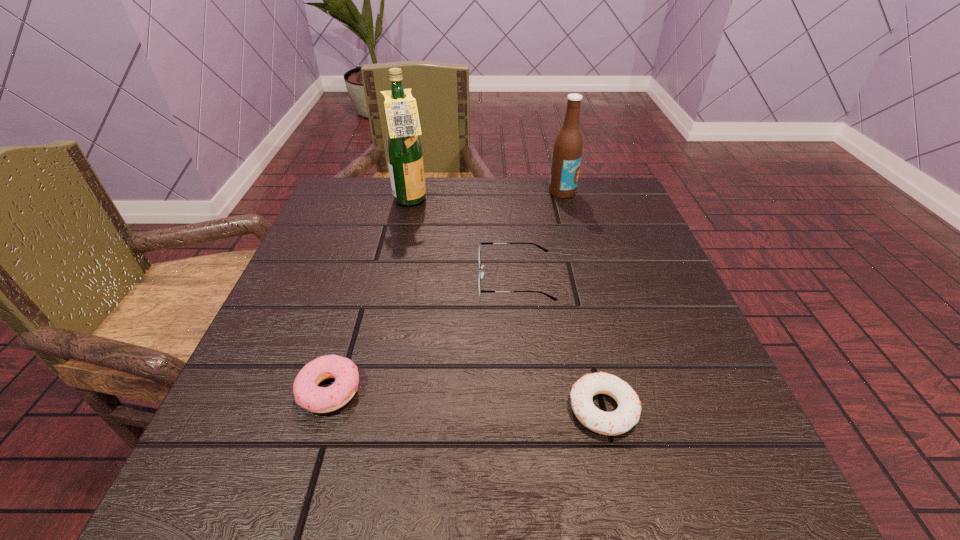
Identify the location of vacant area that lies between the spectacles and the left doughnut. (422, 335).

At what (x,y) coordinates should I click in order to perform the action: click on vacant space that's between the right doughnut and the left doughnut. Please return your answer as a coordinate pair (x, y). This screenshot has width=960, height=540. Looking at the image, I should click on click(x=467, y=400).

The width and height of the screenshot is (960, 540). In order to click on free space between the right doughnut and the liquor in this screenshot , I will do `click(507, 305)`.

You are a GUI agent. You are given a task and a screenshot of the screen. Output one action in this format:
    pyautogui.click(x=<x>, y=<y>)
    Task: Click on the free spot between the third tallest object and the left doughnut
    Image resolution: width=960 pixels, height=540 pixels.
    Given the screenshot: What is the action you would take?
    pyautogui.click(x=422, y=335)

You are a GUI agent. You are given a task and a screenshot of the screen. Output one action in this format:
    pyautogui.click(x=<x>, y=<y>)
    Task: Click on the free spot between the tallest object and the fourth shortest object
    The width and height of the screenshot is (960, 540).
    Given the screenshot: What is the action you would take?
    pyautogui.click(x=487, y=197)

Locate an element on the screen. This screenshot has width=960, height=540. free spot between the liquor and the right doughnut is located at coordinates (507, 305).

This screenshot has width=960, height=540. I want to click on free space between the left doughnut and the tallest object, so click(x=371, y=296).

Image resolution: width=960 pixels, height=540 pixels. In order to click on free space between the left doughnut and the right doughnut in this screenshot , I will do `click(467, 400)`.

Locate an element on the screen. Image resolution: width=960 pixels, height=540 pixels. object that stands as the closest to the third nearest object is located at coordinates (627, 414).

At what (x,y) coordinates should I click in order to perform the action: click on the third closest object relative to the fourth shortest object. Please return your answer as a coordinate pair (x, y). Looking at the image, I should click on (627, 414).